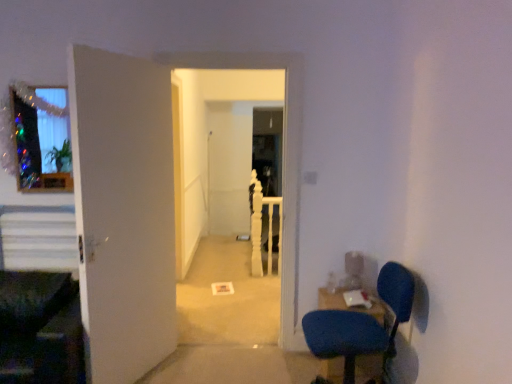
This screenshot has width=512, height=384. What are the coordinates of `vacant space underneath white matte carpet at center (from a real-world perspective)` in the screenshot? It's located at (229, 342).